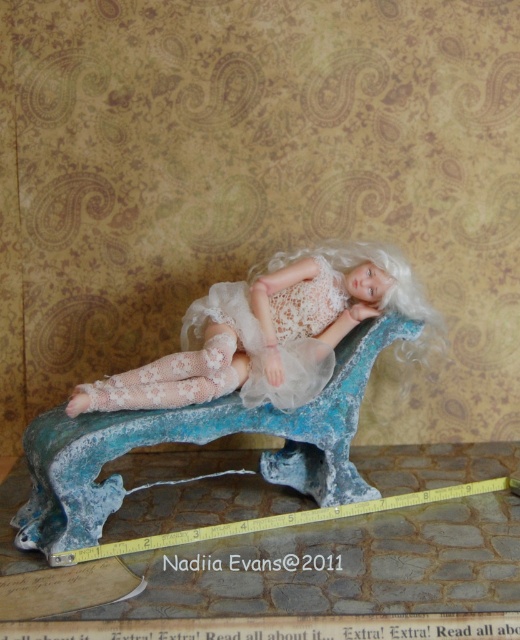
Who is shorter, white lace dress at center or yellow rubber tape measure at lower center?

Standing shorter between the two is yellow rubber tape measure at lower center.

Does point (307, 330) lie in front of point (471, 493)?

Yes, it is in front of point (471, 493).

Where is `white lace dress at center`? Image resolution: width=520 pixels, height=640 pixels. white lace dress at center is located at coordinates (x=277, y=333).

Is lace fabric doll at center below yellow rubber tape measure at lower center?

No.

Who is higher up, lace fabric doll at center or yellow rubber tape measure at lower center?

Positioned higher is lace fabric doll at center.

This screenshot has width=520, height=640. What do you see at coordinates (265, 333) in the screenshot? I see `lace fabric doll at center` at bounding box center [265, 333].

You are a GUI agent. You are given a task and a screenshot of the screen. Output one action in this format:
    pyautogui.click(x=<x>, y=<y>)
    Task: Click on the lace fabric doll at center
    The image size is (520, 640).
    Given the screenshot: What is the action you would take?
    pyautogui.click(x=265, y=333)

Does lace fabric doll at center have a smaller size compared to white lace dress at center?

Incorrect, lace fabric doll at center is not smaller in size than white lace dress at center.

Is point (327, 324) farther from camera compared to point (187, 333)?

That is False.

This screenshot has width=520, height=640. In order to click on lace fabric doll at center in this screenshot , I will do (x=265, y=333).

The image size is (520, 640). I want to click on lace fabric doll at center, so click(x=265, y=333).